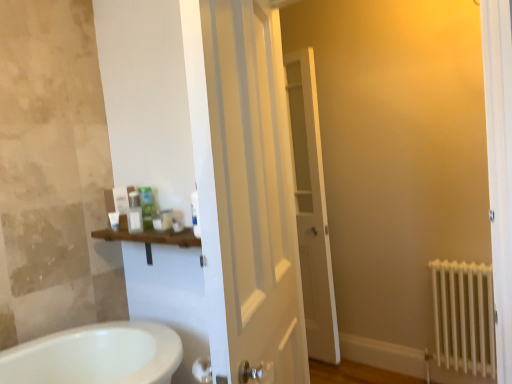
Question: Could white glossy door at center, the 2th door viewed from the back, be considered to be inside matte plastic container at center, the 2th toiletry when ordered from left to right?

Choices:
 (A) no
 (B) yes

Answer: (A)

Question: Is white glossy door at center, the 1th door viewed from the front, at the back of matte plastic container at center, the 4th toiletry when ordered from right to left?

Choices:
 (A) no
 (B) yes

Answer: (A)

Question: Is matte plastic container at center, the 2th toiletry when ordered from left to right, oriented towards white glossy door at center, the 2th door viewed from the back?

Choices:
 (A) no
 (B) yes

Answer: (A)

Question: Is matte plastic container at center, the 2th toiletry when ordered from left to right, outside white glossy door at center, the 1th door viewed from the front?

Choices:
 (A) no
 (B) yes

Answer: (B)

Question: Is matte plastic container at center, the 4th toiletry when ordered from right to left, in front of white glossy door at center, the 1th door viewed from the front?

Choices:
 (A) no
 (B) yes

Answer: (A)

Question: Is matte plastic container at center, the 4th toiletry when ordered from right to left, inside or outside of translucent plastic container at upper center, which is counted as the second toiletry, starting from the right?

Choices:
 (A) inside
 (B) outside

Answer: (B)

Question: From their relative heights in the image, would you say matte plastic container at center, the 2th toiletry when ordered from left to right, is taller or shorter than translucent plastic container at upper center, which is the 4th toiletry from left to right?

Choices:
 (A) short
 (B) tall

Answer: (B)

Question: In the image, is matte plastic container at center, the 2th toiletry when ordered from left to right, positioned in front of or behind translucent plastic container at upper center, which is the 4th toiletry from left to right?

Choices:
 (A) front
 (B) behind

Answer: (B)

Question: Considering the positions of matte plastic container at center, the 4th toiletry when ordered from right to left, and translucent plastic container at upper center, which is the 4th toiletry from left to right, in the image, is matte plastic container at center, the 4th toiletry when ordered from right to left, bigger or smaller than translucent plastic container at upper center, which is the 4th toiletry from left to right,?

Choices:
 (A) small
 (B) big

Answer: (A)

Question: From a real-world perspective, relative to white glossy door at center, marked as the second door in a front-to-back arrangement, is matte white container at center, which is the fifth toiletry in left-to-right order, vertically above or below?

Choices:
 (A) below
 (B) above

Answer: (B)

Question: Based on their positions, is matte white container at center, which is the fifth toiletry in left-to-right order, located to the left or right of white glossy door at center, marked as the second door in a front-to-back arrangement?

Choices:
 (A) right
 (B) left

Answer: (B)

Question: In terms of width, does matte white container at center, which is the fifth toiletry in left-to-right order, look wider or thinner when compared to white glossy door at center, marked as the second door in a front-to-back arrangement?

Choices:
 (A) thin
 (B) wide

Answer: (A)

Question: Considering their positions, is matte white container at center, which is the fifth toiletry in left-to-right order, located in front of or behind white glossy door at center, marked as the second door in a front-to-back arrangement?

Choices:
 (A) behind
 (B) front

Answer: (B)

Question: In terms of height, does matte plastic container at center, the 2th toiletry when ordered from left to right, look taller or shorter compared to matte white container at center, which is the fifth toiletry in left-to-right order?

Choices:
 (A) short
 (B) tall

Answer: (B)

Question: Would you say matte plastic container at center, the 2th toiletry when ordered from left to right, is inside or outside matte white container at center, which is the 1th toiletry in right-to-left order?

Choices:
 (A) inside
 (B) outside

Answer: (B)